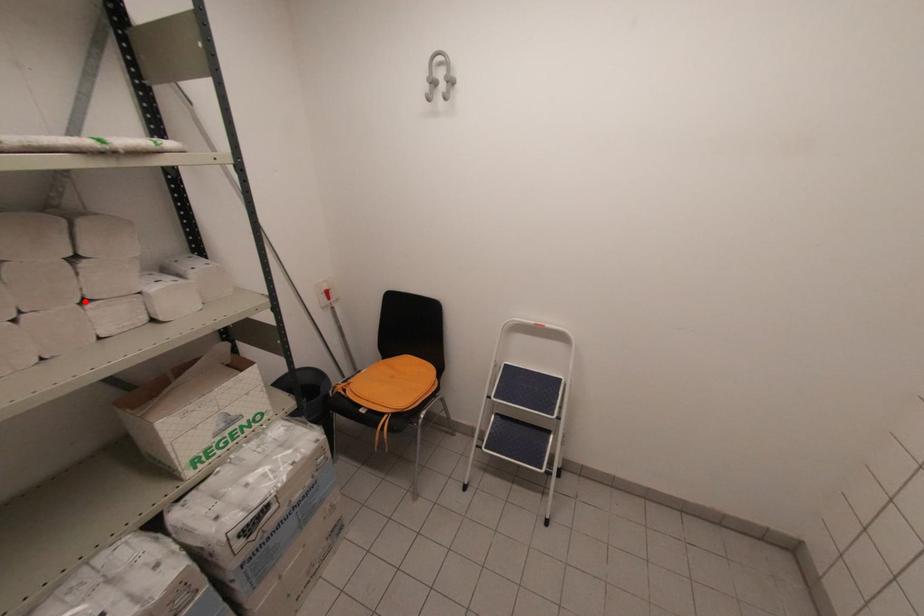
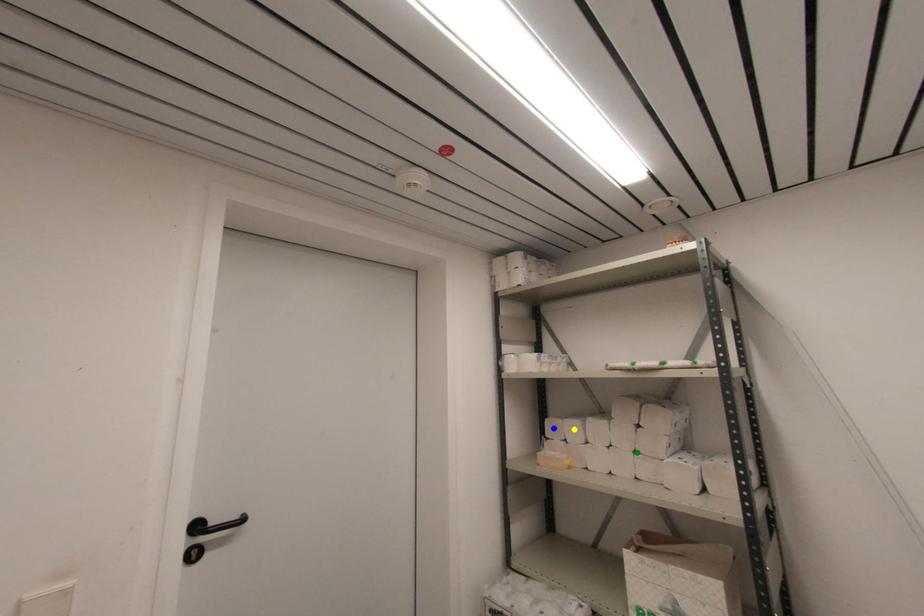
Question: I am providing you with two images of the same scene from different viewpoints. A red point is marked on the first image. You are given multiple points on the second image. Can you choose the point in image 2 that corresponds to the point in image 1?

Choices:
 (A) blue point
 (B) green point
 (C) yellow point

Answer: (B)